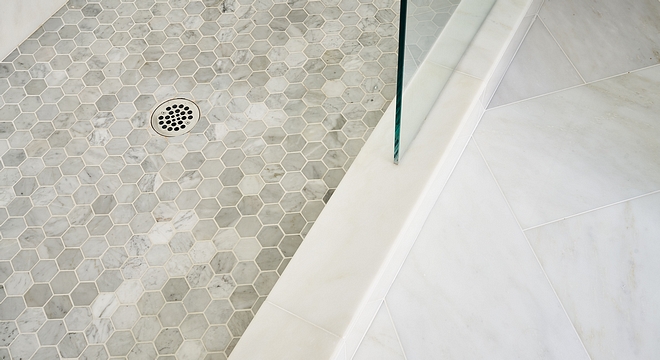
The width and height of the screenshot is (660, 360). I want to click on grey marble tile, so click(x=544, y=59), click(x=608, y=34).